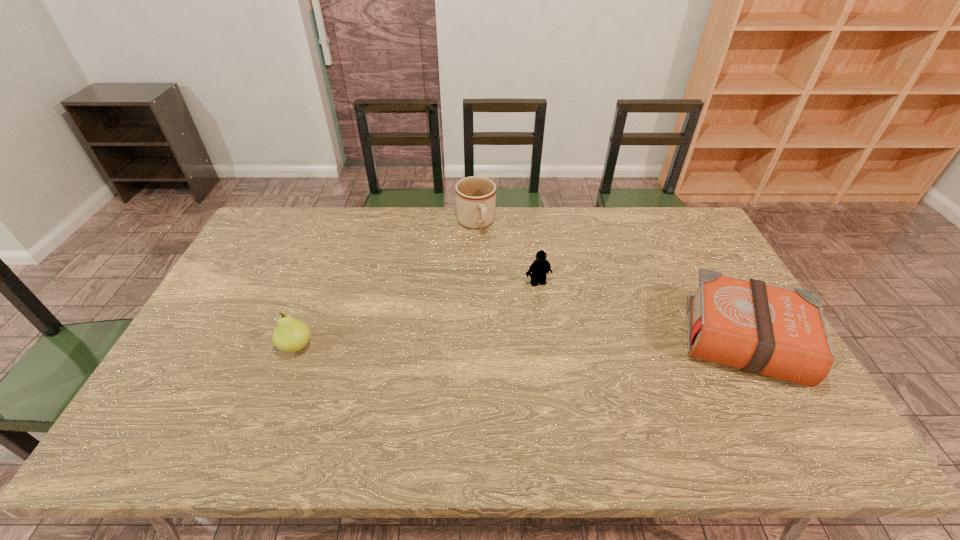
Find the location of a particular element. This screenshot has width=960, height=540. vacant point located between the farthest object and the third nearest object is located at coordinates (507, 253).

Where is `free space between the third nearest object and the leftmost object`? The image size is (960, 540). free space between the third nearest object and the leftmost object is located at coordinates (417, 314).

Locate an element on the screen. The image size is (960, 540). free point between the third object from right to left and the Bible is located at coordinates (610, 282).

Image resolution: width=960 pixels, height=540 pixels. I want to click on free spot between the Lego and the rightmost object, so pos(641,312).

Locate which object is the third closest to the pear. Please provide its 2D coordinates. Your answer should be formatted as a tuple, i.e. [(x, y)], where the tuple contains the x and y coordinates of a point satisfying the conditions above.

[(760, 328)]

You are a GUI agent. You are given a task and a screenshot of the screen. Output one action in this format:
    pyautogui.click(x=<x>, y=<y>)
    Task: Click on the object that stands as the second closest to the leftmost object
    The height and width of the screenshot is (540, 960).
    Given the screenshot: What is the action you would take?
    pyautogui.click(x=540, y=267)

I want to click on blank space that satisfies the following two spatial constraints: 1. on the back side of the farthest object; 2. on the left side of the pear, so click(x=343, y=224).

Locate an element on the screen. Image resolution: width=960 pixels, height=540 pixels. free region that satisfies the following two spatial constraints: 1. on the front side of the mug; 2. on the right side of the Bible is located at coordinates (474, 342).

Where is `vacant space that satisfies the following two spatial constraints: 1. on the front side of the mug; 2. on the right side of the third nearest object`? Image resolution: width=960 pixels, height=540 pixels. vacant space that satisfies the following two spatial constraints: 1. on the front side of the mug; 2. on the right side of the third nearest object is located at coordinates (475, 283).